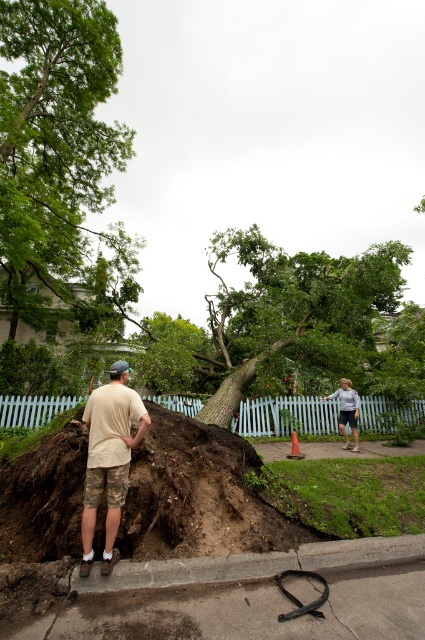
Question: Does green leafy tree at upper left come behind brown dirt mound at lower left?

Choices:
 (A) no
 (B) yes

Answer: (B)

Question: Is gray concrete curb at lower center positioned in front of camouflage shorts at left?

Choices:
 (A) yes
 (B) no

Answer: (A)

Question: Considering the real-world distances, which object is farthest from the light blue denim shorts at center?

Choices:
 (A) brown dirt mound at lower left
 (B) gray concrete curb at lower center

Answer: (A)

Question: Which point is farther to the camera?

Choices:
 (A) pyautogui.click(x=121, y=474)
 (B) pyautogui.click(x=6, y=580)

Answer: (A)

Question: Can you confirm if green leafy tree at upper left is positioned to the left of brown dirt mound at lower left?

Choices:
 (A) yes
 (B) no

Answer: (A)

Question: Among these objects, which one is nearest to the camera?

Choices:
 (A) light blue denim shorts at center
 (B) green leafy tree at upper left
 (C) camouflage shorts at left

Answer: (C)